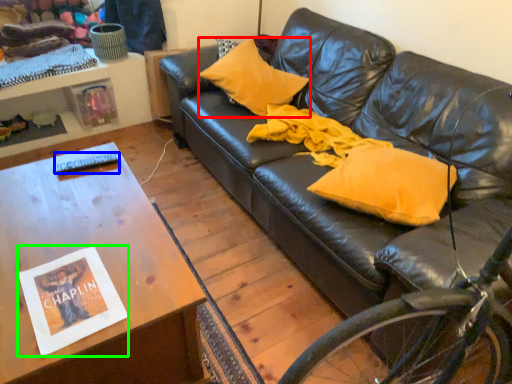
Question: Estimate the real-world distances between objects in this image. Which object is farther from pillow (highlighted by a red box), remote control (highlighted by a blue box) or magazine (highlighted by a green box)?

Choices:
 (A) remote control
 (B) magazine

Answer: (B)